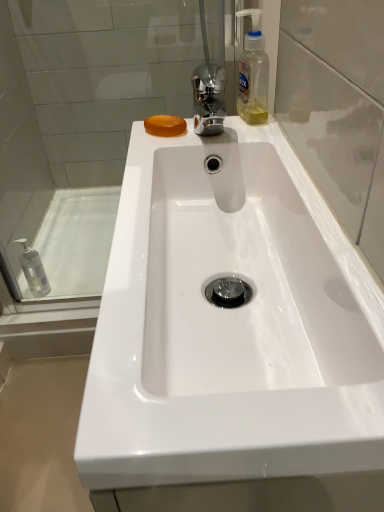
At what (x,y) coordinates should I click in order to perform the action: click on vacant space in between clear plastic bottle at upper right and transparent glass door at upper right. Please return your answer as a coordinate pair (x, y). The height and width of the screenshot is (512, 384). Looking at the image, I should click on (285, 164).